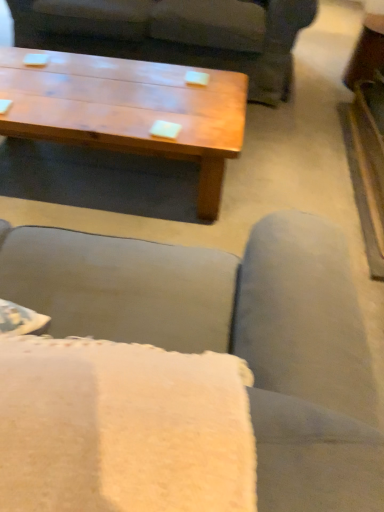
Identify the location of matte gray couch at center. (177, 34).

What do you see at coordinates (177, 34) in the screenshot?
I see `matte gray couch at center` at bounding box center [177, 34].

Where is `wooden coffee table at upper center`? This screenshot has height=512, width=384. wooden coffee table at upper center is located at coordinates (128, 110).

Describe the element at coordinates (128, 110) in the screenshot. The width and height of the screenshot is (384, 512). I see `wooden coffee table at upper center` at that location.

Where is `matte gray couch at center`? This screenshot has width=384, height=512. matte gray couch at center is located at coordinates (177, 34).

Is wooden coffee table at upper center at the left side of matte gray couch at center?

Correct, you'll find wooden coffee table at upper center to the left of matte gray couch at center.

Considering their positions, is wooden coffee table at upper center located in front of or behind matte gray couch at center?

wooden coffee table at upper center is positioned closer to the viewer than matte gray couch at center.

Is point (203, 118) less distant than point (104, 21)?

Yes, point (203, 118) is in front of point (104, 21).

From the image's perspective, is wooden coffee table at upper center on top of matte gray couch at center?

No, from the image's perspective, wooden coffee table at upper center is not over matte gray couch at center.

From a real-world perspective, does wooden coffee table at upper center stand above matte gray couch at center?

Incorrect, from a real-world perspective, wooden coffee table at upper center is lower than matte gray couch at center.

Considering the relative sizes of wooden coffee table at upper center and matte gray couch at center in the image provided, is wooden coffee table at upper center wider than matte gray couch at center?

No.

Which of these two, wooden coffee table at upper center or matte gray couch at center, stands shorter?

With less height is wooden coffee table at upper center.

Can you confirm if wooden coffee table at upper center is smaller than matte gray couch at center?

Yes.

Could matte gray couch at center be considered to be inside wooden coffee table at upper center?

No, wooden coffee table at upper center does not contain matte gray couch at center.

Is wooden coffee table at upper center next to matte gray couch at center and touching it?

No, wooden coffee table at upper center is not next to matte gray couch at center.

Based on the photo, is matte gray couch at center at the back of wooden coffee table at upper center?

Absolutely, wooden coffee table at upper center is directed away from matte gray couch at center.

What's the angular difference between wooden coffee table at upper center and matte gray couch at center's facing directions?

9.76e-05 degrees separate the facing orientations of wooden coffee table at upper center and matte gray couch at center.

At what (x,y) coordinates should I click in order to perform the action: click on coffee table in front of the matte gray couch at center. Please return your answer as a coordinate pair (x, y). This screenshot has height=512, width=384. Looking at the image, I should click on (128, 110).

Is matte gray couch at center to the left of wooden coffee table at upper center from the viewer's perspective?

Incorrect, matte gray couch at center is not on the left side of wooden coffee table at upper center.

Which object is further away from the camera, matte gray couch at center or wooden coffee table at upper center?

matte gray couch at center is more distant.

Is point (260, 81) closer to viewer compared to point (128, 65)?

No, (260, 81) is further to viewer.

From the image's perspective, between matte gray couch at center and wooden coffee table at upper center, which one is located above?

matte gray couch at center.

From a real-world perspective, is matte gray couch at center under wooden coffee table at upper center?

No, from a real-world perspective, matte gray couch at center is not under wooden coffee table at upper center.

Can you confirm if matte gray couch at center is thinner than wooden coffee table at upper center?

In fact, matte gray couch at center might be wider than wooden coffee table at upper center.

Between matte gray couch at center and wooden coffee table at upper center, which one has less height?

Standing shorter between the two is wooden coffee table at upper center.

Looking at the image, does matte gray couch at center seem bigger or smaller compared to wooden coffee table at upper center?

Clearly, matte gray couch at center is larger in size than wooden coffee table at upper center.

Would you say matte gray couch at center is inside or outside wooden coffee table at upper center?

matte gray couch at center is outside wooden coffee table at upper center.

Does matte gray couch at center touch wooden coffee table at upper center?

There is a gap between matte gray couch at center and wooden coffee table at upper center.

Could you tell me if matte gray couch at center is facing wooden coffee table at upper center?

Yes, matte gray couch at center is aimed at wooden coffee table at upper center.

Can you tell me how much matte gray couch at center and wooden coffee table at upper center differ in facing direction?

The angle between the facing direction of matte gray couch at center and the facing direction of wooden coffee table at upper center is 9.76e-05 degrees.

I want to click on coffee table located in front of the matte gray couch at center, so click(128, 110).

The image size is (384, 512). What are the coordinates of `studio couch lying behind the wooden coffee table at upper center` in the screenshot? It's located at [x=177, y=34].

There is a wooden coffee table at upper center. Where is `studio couch above it (from a real-world perspective)`? studio couch above it (from a real-world perspective) is located at coordinates (177, 34).